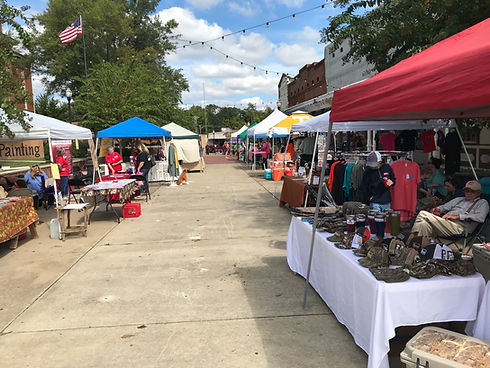
The height and width of the screenshot is (368, 490). In order to click on chest in this screenshot , I will do `click(435, 350)`.